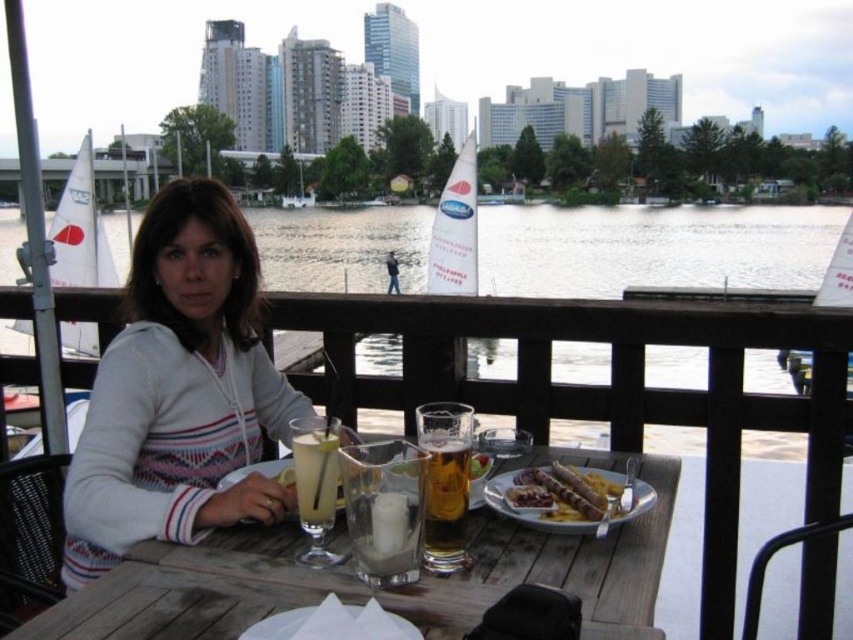
You are a photographer standing at the riverside. You want to take a photo of the wooden table at center and the golden crispy sausages at lower center. Which object should you adjust your camera angle to focus on first if you are looking from above?

The wooden table at center is located below the golden crispy sausages at lower center. Since you are looking from above, you should first focus on the golden crispy sausages at lower center before adjusting to capture the wooden table at center which is positioned beneath it.

You are a waiter at the riverside table. You need to place a new drink order on the table. The customer ordered a drink that requires a glass 10 cm in diameter. You have two glasses available on the table. Which glass from the two options, the transparent glass water at center or the translucent glass beer at center, is more likely to accommodate the new drink based on their widths?

The transparent glass water at center might be wider than the translucent glass beer at center, so it is more likely to accommodate the new drink with a 10 cm diameter.